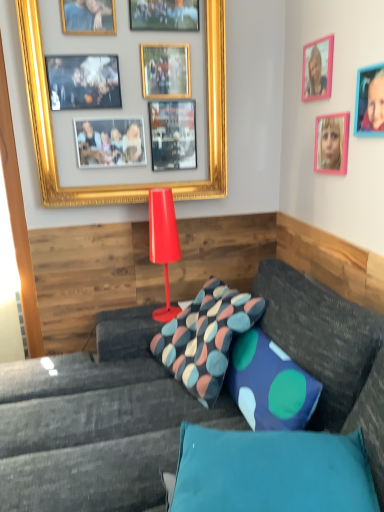
Question: Does pink plastic picture frame at upper right, positioned as the 4th picture frame in left-to-right order, lie behind shiny red lamp at center?

Choices:
 (A) yes
 (B) no

Answer: (B)

Question: Does pink plastic picture frame at upper right, which is counted as the 1th picture frame, starting from the right, have a larger size compared to shiny red lamp at center?

Choices:
 (A) no
 (B) yes

Answer: (A)

Question: From the image's perspective, is pink plastic picture frame at upper right, positioned as the 4th picture frame in left-to-right order, on shiny red lamp at center?

Choices:
 (A) yes
 (B) no

Answer: (A)

Question: Could you tell me if pink plastic picture frame at upper right, positioned as the 4th picture frame in left-to-right order, is facing shiny red lamp at center?

Choices:
 (A) yes
 (B) no

Answer: (B)

Question: Can you confirm if pink plastic picture frame at upper right, which is counted as the 1th picture frame, starting from the right, is shorter than shiny red lamp at center?

Choices:
 (A) yes
 (B) no

Answer: (A)

Question: Considering the relative positions of pink plastic picture frame at upper right, which is counted as the 1th picture frame, starting from the right, and shiny red lamp at center in the image provided, is pink plastic picture frame at upper right, which is counted as the 1th picture frame, starting from the right, to the right of shiny red lamp at center from the viewer's perspective?

Choices:
 (A) no
 (B) yes

Answer: (B)

Question: Is multicolored fabric pillow at center, the first pillow viewed from the back, at the left side of teal fabric pillow at lower center, which is counted as the 2th pillow, starting from the back?

Choices:
 (A) yes
 (B) no

Answer: (A)

Question: Does multicolored fabric pillow at center, the 2th pillow when ordered from front to back, have a lesser height compared to teal fabric pillow at lower center, the 1th pillow in the front-to-back sequence?

Choices:
 (A) no
 (B) yes

Answer: (A)

Question: Does multicolored fabric pillow at center, the 2th pillow when ordered from front to back, contain teal fabric pillow at lower center, the 1th pillow in the front-to-back sequence?

Choices:
 (A) no
 (B) yes

Answer: (A)

Question: Considering the relative sizes of multicolored fabric pillow at center, the first pillow viewed from the back, and teal fabric pillow at lower center, which is counted as the 2th pillow, starting from the back, in the image provided, is multicolored fabric pillow at center, the first pillow viewed from the back, thinner than teal fabric pillow at lower center, which is counted as the 2th pillow, starting from the back,?

Choices:
 (A) no
 (B) yes

Answer: (B)

Question: Does multicolored fabric pillow at center, the first pillow viewed from the back, lie behind teal fabric pillow at lower center, which is counted as the 2th pillow, starting from the back?

Choices:
 (A) no
 (B) yes

Answer: (B)

Question: From the image's perspective, is multicolored fabric pillow at center, the 2th pillow when ordered from front to back, below teal fabric pillow at lower center, the 1th pillow in the front-to-back sequence?

Choices:
 (A) yes
 (B) no

Answer: (B)

Question: Is pink plastic picture frame at upper right, which is counted as the 1th picture frame, starting from the right, positioned with its back to pink plastic picture frame at upper right, which ranks as the 2th picture frame in right-to-left order?

Choices:
 (A) yes
 (B) no

Answer: (B)